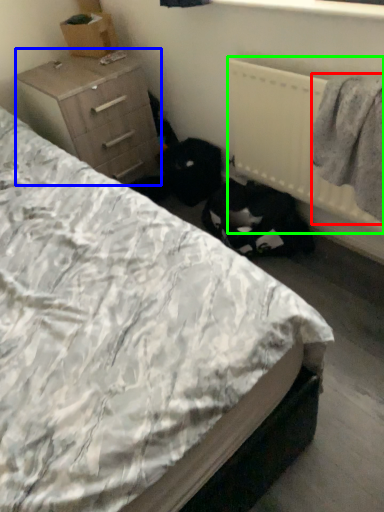
Question: Which object is positioned farthest from clothing (highlighted by a red box)? Select from chest of drawers (highlighted by a blue box) and radiator (highlighted by a green box).

Choices:
 (A) chest of drawers
 (B) radiator

Answer: (A)